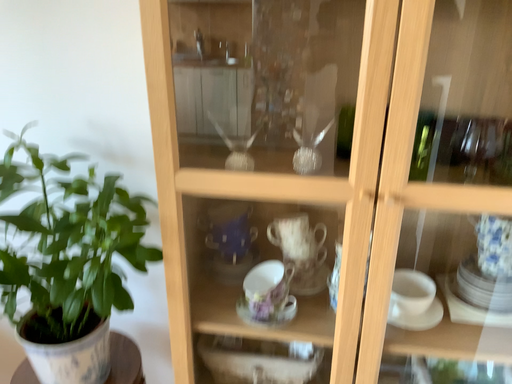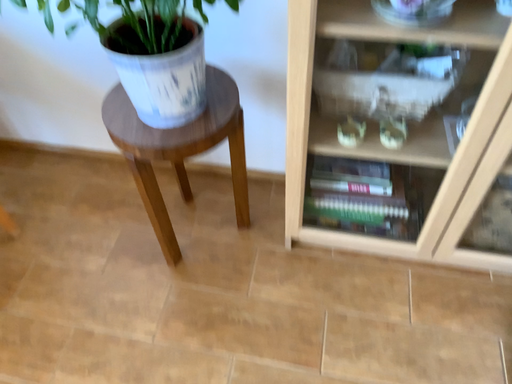
Question: Which way did the camera rotate in the video?

Choices:
 (A) rotated upward
 (B) rotated downward

Answer: (B)